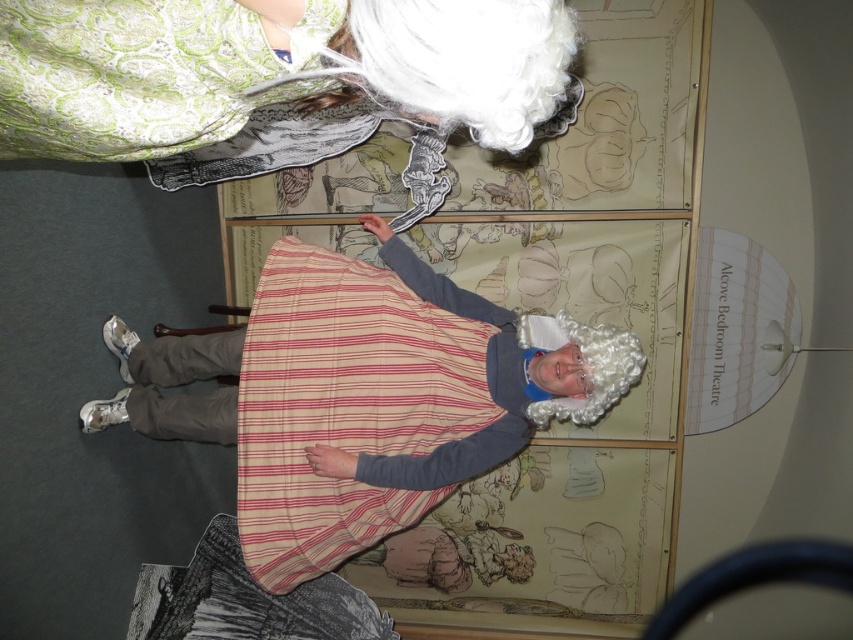
Question: Among these objects, which one is nearest to the camera?

Choices:
 (A) striped cotton apron at center
 (B) matte white wig at upper center

Answer: (B)

Question: Can you confirm if matte white wig at upper center is thinner than striped cotton apron at center?

Choices:
 (A) no
 (B) yes

Answer: (A)

Question: Among these points, which one is farthest from the camera?

Choices:
 (A) (367, 332)
 (B) (560, 99)

Answer: (A)

Question: Can you confirm if matte white wig at upper center is positioned above striped cotton apron at center?

Choices:
 (A) no
 (B) yes

Answer: (B)

Question: Does matte white wig at upper center appear under striped cotton apron at center?

Choices:
 (A) no
 (B) yes

Answer: (A)